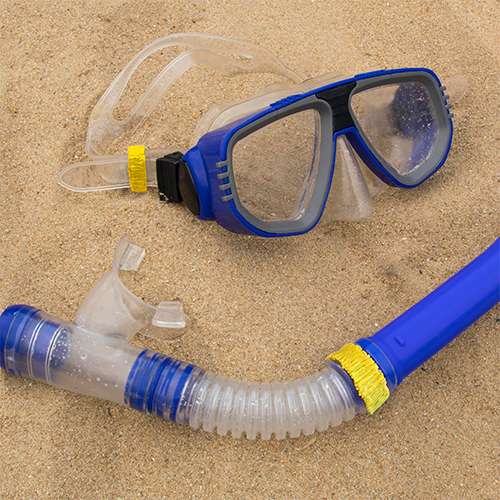
The height and width of the screenshot is (500, 500). Find the location of `blue frame`. blue frame is located at coordinates (229, 210).